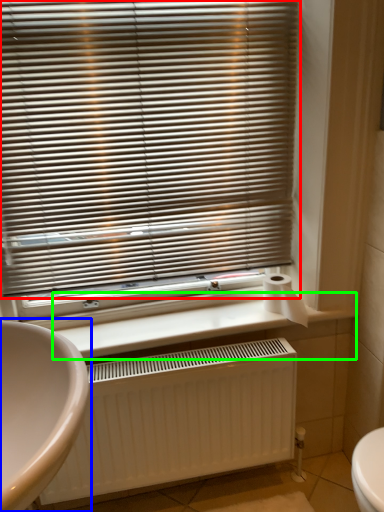
Question: Which is nearer to the window blind (highlighted by a red box)? sink (highlighted by a blue box) or counter top (highlighted by a green box).

Choices:
 (A) sink
 (B) counter top

Answer: (B)